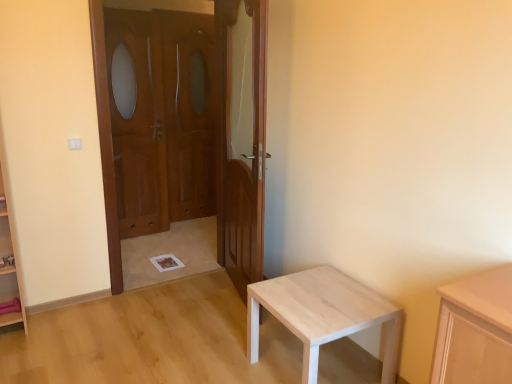
Identify the location of free space underneath light wood table at lower right (from a real-world perspective). (321, 365).